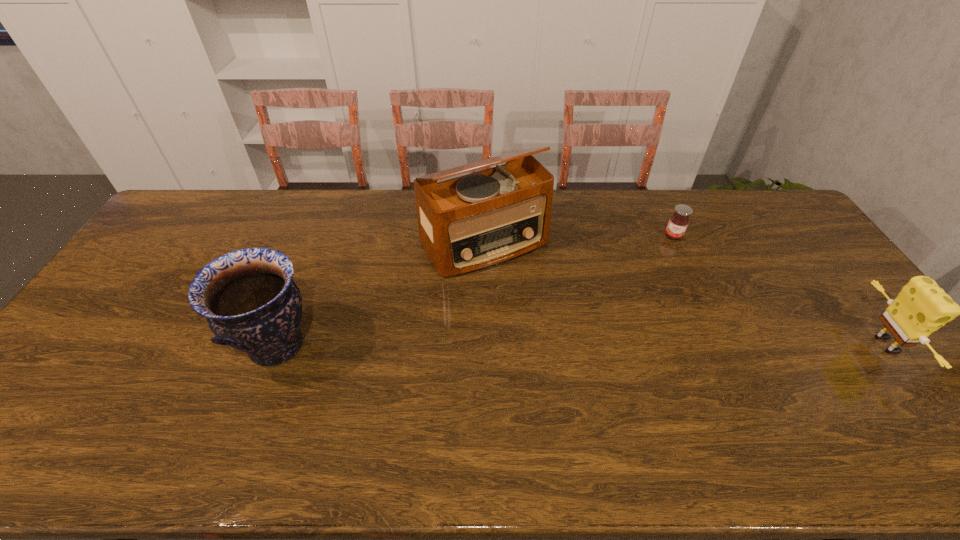
What are the coordinates of `vacant space on the desktop that is between the second tallest object and the rightmost object and is positioned on the front panel of the radio receiver` in the screenshot? It's located at (559, 345).

Locate an element on the screen. The image size is (960, 540). free space on the desktop that is between the pottery and the rightmost object and is positioned on the label side of the jam is located at coordinates (650, 345).